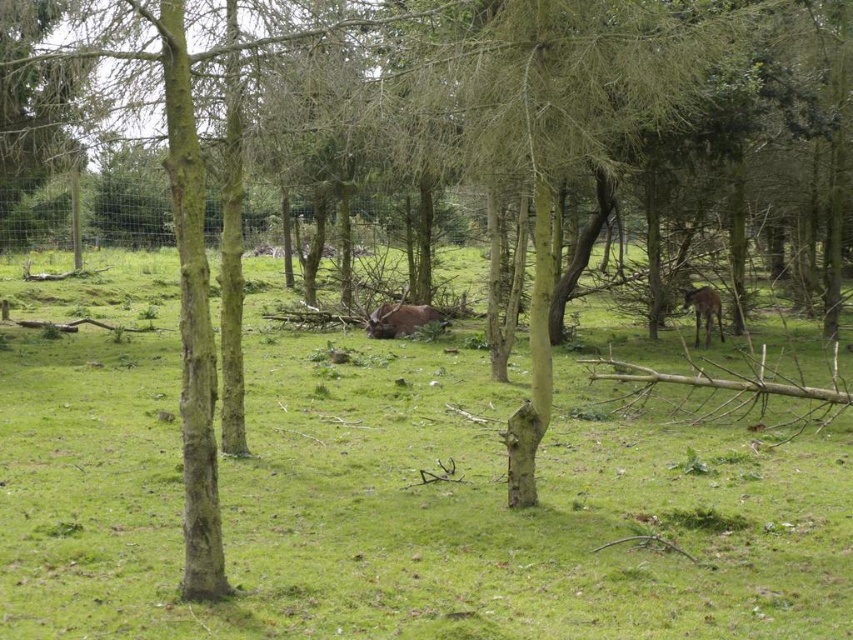
You are standing in the woodland scene described. You need to locate the brown furry bull at center. Based on the coordinates provided, where should you look to find it?

The brown furry bull at center is located at coordinates point (401,320).

You are a hiker standing in the green grassy field at center. You notice the brown furry deer at right. Which direction should you move to get closer to the deer?

The brown furry deer at right is positioned above the green grassy field at center, so you should move forward to get closer to the deer.